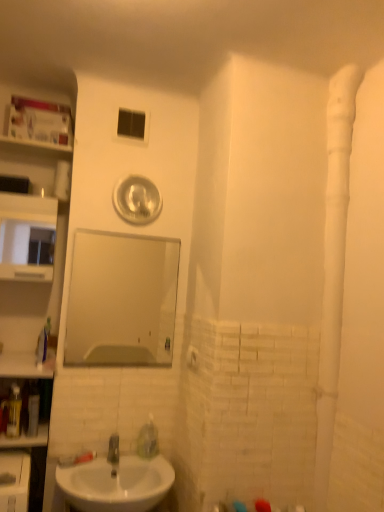
Question: From the image's perspective, is white matte water pipe at right on transparent plastic window at upper center?

Choices:
 (A) no
 (B) yes

Answer: (A)

Question: Is white matte water pipe at right facing away from transparent plastic window at upper center?

Choices:
 (A) yes
 (B) no

Answer: (B)

Question: Does white matte water pipe at right appear on the left side of transparent plastic window at upper center?

Choices:
 (A) no
 (B) yes

Answer: (A)

Question: Is white matte water pipe at right wider than transparent plastic window at upper center?

Choices:
 (A) no
 (B) yes

Answer: (B)

Question: From the image's perspective, would you say white matte water pipe at right is shown under transparent plastic window at upper center?

Choices:
 (A) no
 (B) yes

Answer: (B)

Question: Is white cardboard box at upper left taller or shorter than matte white medicine cabinet at left?

Choices:
 (A) tall
 (B) short

Answer: (B)

Question: Is point (33, 123) positioned closer to the camera than point (3, 276)?

Choices:
 (A) farther
 (B) closer

Answer: (A)

Question: From the image's perspective, is white cardboard box at upper left above or below matte white medicine cabinet at left?

Choices:
 (A) above
 (B) below

Answer: (A)

Question: From a real-world perspective, is white cardboard box at upper left positioned above or below matte white medicine cabinet at left?

Choices:
 (A) below
 (B) above

Answer: (B)

Question: Considering the positions of translucent plastic bottle at left and matte white medicine cabinet at left in the image, is translucent plastic bottle at left bigger or smaller than matte white medicine cabinet at left?

Choices:
 (A) small
 (B) big

Answer: (A)

Question: In the image, is translucent plastic bottle at left on the left side or the right side of matte white medicine cabinet at left?

Choices:
 (A) right
 (B) left

Answer: (A)

Question: Is point (11, 396) closer or farther from the camera than point (26, 215)?

Choices:
 (A) farther
 (B) closer

Answer: (B)

Question: Is translucent plastic bottle at left in front of or behind matte white medicine cabinet at left in the image?

Choices:
 (A) behind
 (B) front

Answer: (B)

Question: In terms of width, does clear glass mirror at center look wider or thinner when compared to white glossy sink at lower left?

Choices:
 (A) thin
 (B) wide

Answer: (A)

Question: From the image's perspective, is clear glass mirror at center positioned above or below white glossy sink at lower left?

Choices:
 (A) above
 (B) below

Answer: (A)